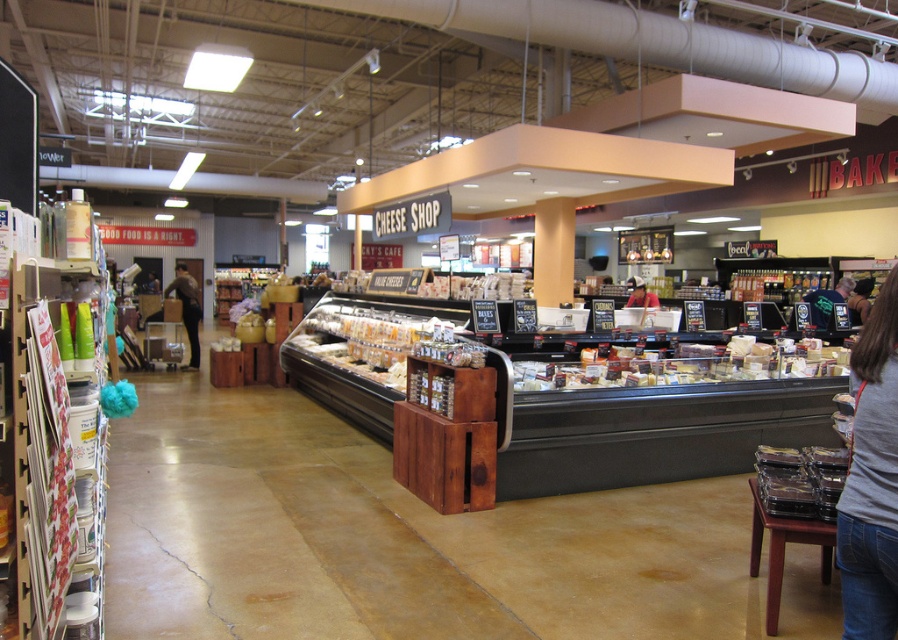
You are a customer in the grocery store and want to pick up both the gray cotton shirt at lower right and the brown leather jacket at left. Which item will you need to reach for first if you are standing in front of the refrigerated display case?

You should reach for the gray cotton shirt at lower right first because it is closer to you than the brown leather jacket at left, which is further away.

You are a customer in the grocery store and you want to pick up the gray cotton shirt at lower right and the brown leather jacket at left. Which one is located to the right of the other?

The gray cotton shirt at lower right is positioned on the right side of brown leather jacket at left.

From the picture: You are a customer looking at the cheese shop section. You see a gray cotton shirt at lower right and translucent plastic containers at center. Which item is closer to you?

The gray cotton shirt at lower right is closer to you because it is in front of the translucent plastic containers at center.